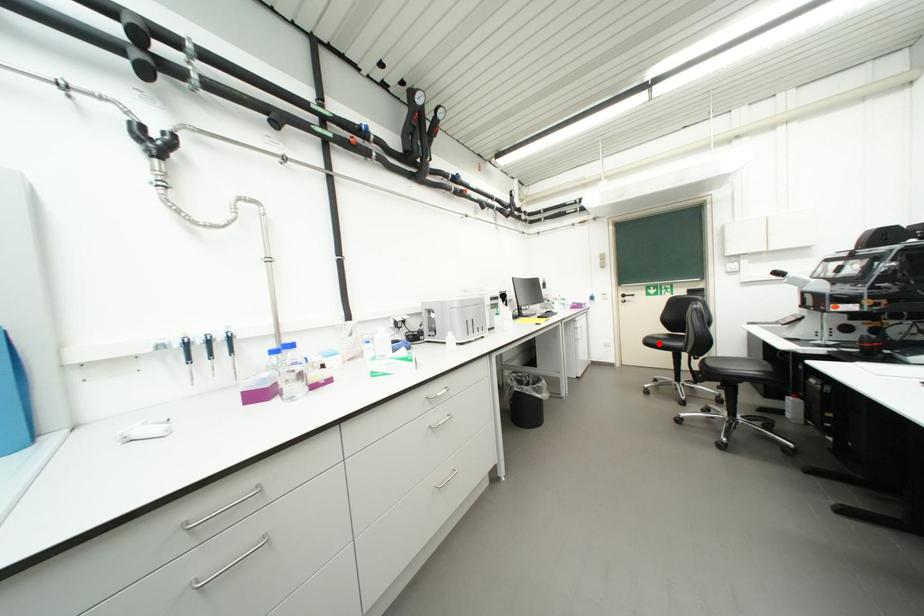
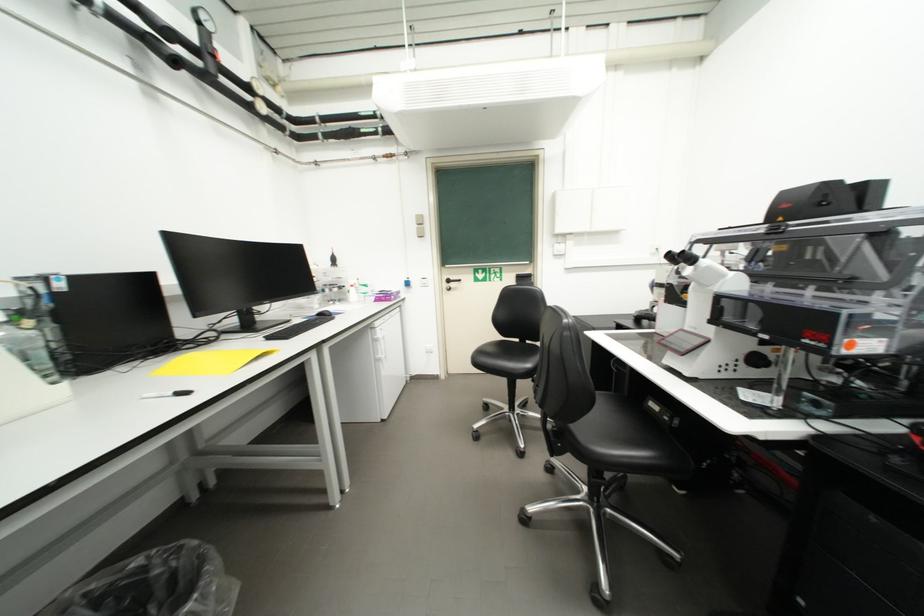
Question: A red point is marked in image1. In image2, is the corresponding 3D point closer to the camera or farther? Reply with the corresponding letter.

Choices:
 (A) The corresponding 3D point is closer.
 (B) The corresponding 3D point is farther.

Answer: (B)